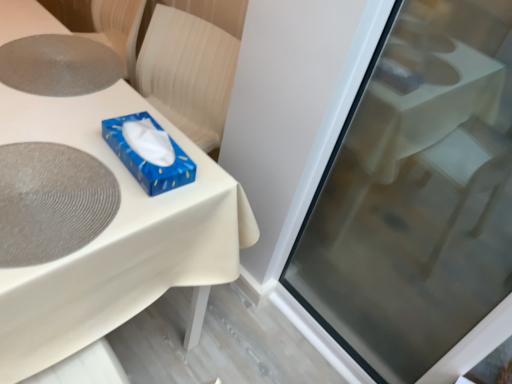
In order to click on vacant area that lies between matte gray placemat at upper left, the first oval in the bottom-to-top sequence, and blue glossy tissue box at upper center in this screenshot , I will do `click(125, 169)`.